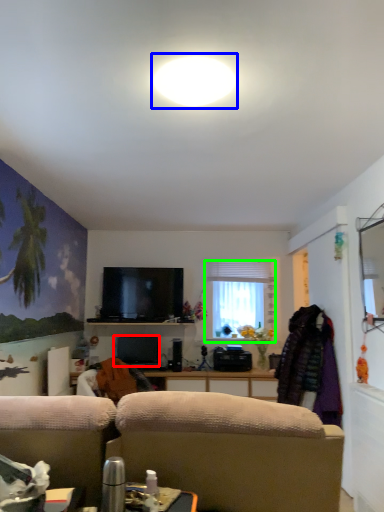
Question: Which object is positioned closest to television (highlighted by a red box)? Select from bright (highlighted by a blue box) and window (highlighted by a green box).

Choices:
 (A) bright
 (B) window

Answer: (B)